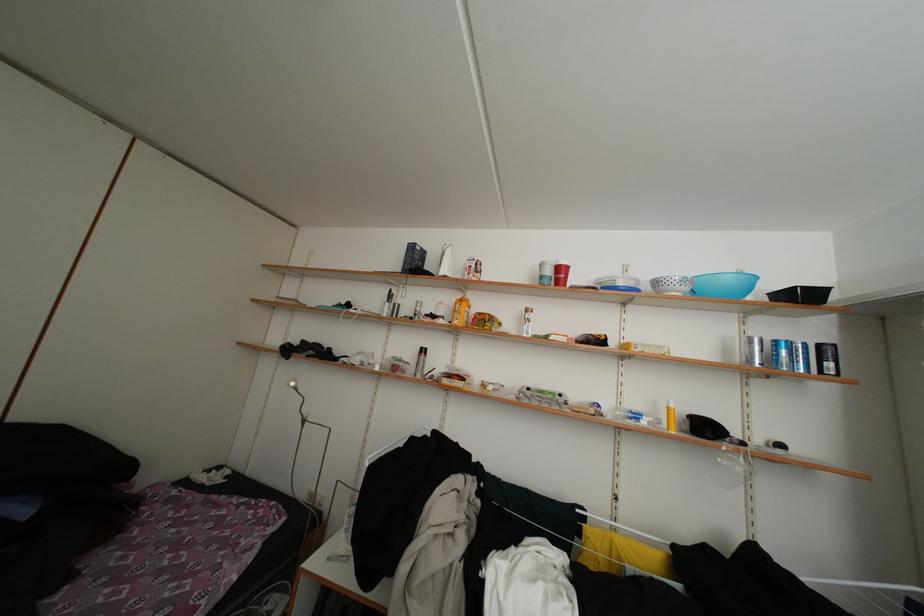
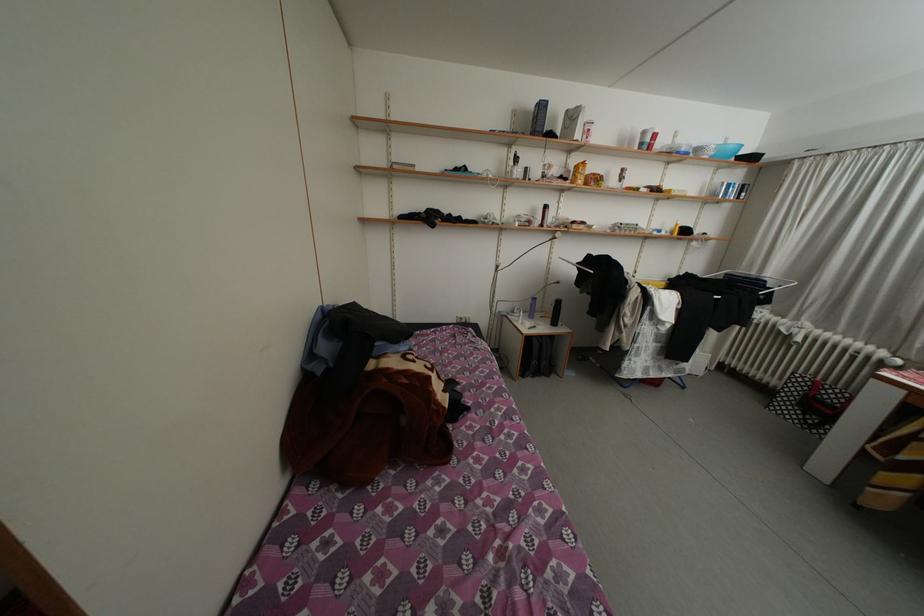
The point at (695, 294) is marked in the first image. Where is the corresponding point in the second image?

(721, 159)